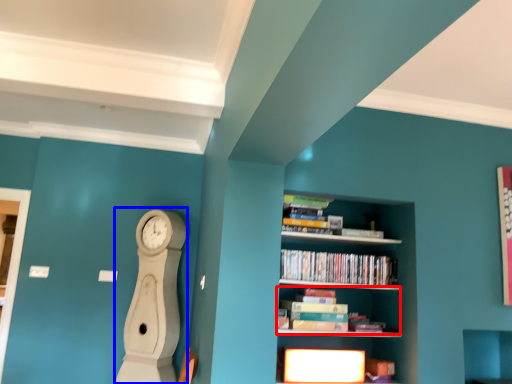
Question: Which object appears closest to the camera in this image, book (highlighted by a red box) or clock (highlighted by a blue box)?

Choices:
 (A) book
 (B) clock

Answer: (A)